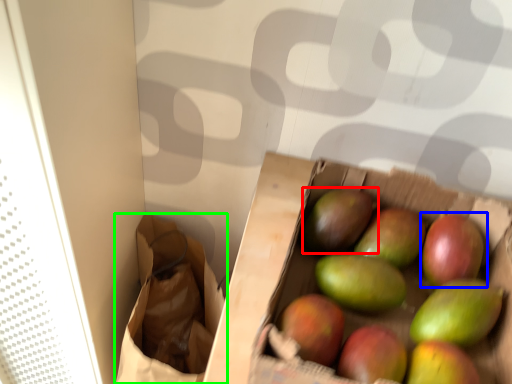
Question: Considering the real-world distances, which object is farthest from mango (highlighted by a red box)? grapefruit (highlighted by a blue box) or shopping bag (highlighted by a green box)?

Choices:
 (A) grapefruit
 (B) shopping bag

Answer: (B)